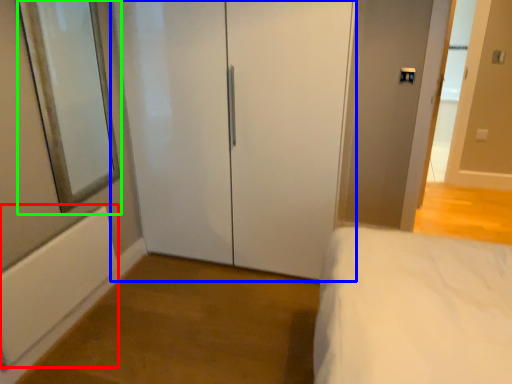
Question: Which object is the farthest from radiator (highlighted by a red box)? Choose among these: door (highlighted by a blue box) or mirror (highlighted by a green box).

Choices:
 (A) door
 (B) mirror

Answer: (A)